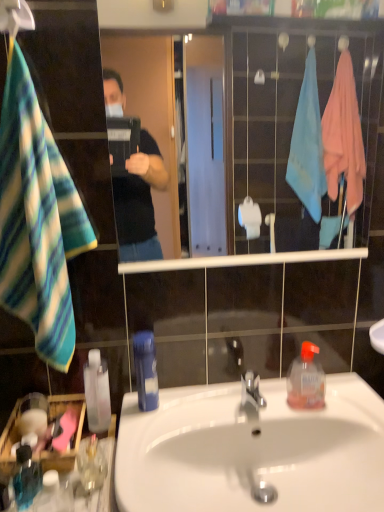
Question: Is translucent glass mug at lower left placed right next to blue plastic bottle at sink, arranged as the fourth bottle when viewed from the left?

Choices:
 (A) yes
 (B) no

Answer: (B)

Question: From the image's perspective, is translucent glass mug at lower left on blue plastic bottle at sink, the 2th bottle when ordered from right to left?

Choices:
 (A) no
 (B) yes

Answer: (A)

Question: Is translucent glass mug at lower left at the left side of blue plastic bottle at sink, the 2th bottle when ordered from right to left?

Choices:
 (A) yes
 (B) no

Answer: (A)

Question: Can you confirm if translucent glass mug at lower left is positioned to the right of blue plastic bottle at sink, arranged as the fourth bottle when viewed from the left?

Choices:
 (A) no
 (B) yes

Answer: (A)

Question: Is blue plastic bottle at sink, arranged as the fourth bottle when viewed from the left, located within translucent glass mug at lower left?

Choices:
 (A) no
 (B) yes

Answer: (A)

Question: In terms of height, does transparent plastic bottle at lower left, which is the 3th bottle from left to right, look taller or shorter compared to white glossy sink at center?

Choices:
 (A) short
 (B) tall

Answer: (A)

Question: From the image's perspective, is transparent plastic bottle at lower left, which is the 3th bottle from left to right, located above or below white glossy sink at center?

Choices:
 (A) above
 (B) below

Answer: (A)

Question: Relative to white glossy sink at center, is transparent plastic bottle at lower left, which is the 3th bottle from left to right, in front or behind?

Choices:
 (A) front
 (B) behind

Answer: (B)

Question: Is transparent plastic bottle at lower left, which is the 3th bottle from left to right, wider or thinner than white glossy sink at center?

Choices:
 (A) thin
 (B) wide

Answer: (A)

Question: From the image's perspective, is translucent glass mug at lower left positioned above or below blue plastic bottle at sink, arranged as the fourth bottle when viewed from the left?

Choices:
 (A) below
 (B) above

Answer: (A)

Question: Is translucent glass mug at lower left inside or outside of blue plastic bottle at sink, the 2th bottle when ordered from right to left?

Choices:
 (A) outside
 (B) inside

Answer: (A)

Question: Relative to blue plastic bottle at sink, arranged as the fourth bottle when viewed from the left, is translucent glass mug at lower left in front or behind?

Choices:
 (A) front
 (B) behind

Answer: (A)

Question: Is point (82, 450) closer or farther from the camera than point (152, 356)?

Choices:
 (A) closer
 (B) farther

Answer: (A)

Question: In terms of size, does translucent glass mug at lower left appear bigger or smaller than translucent plastic hand sanitizer at lower right, marked as the first bottle in a right-to-left arrangement?

Choices:
 (A) small
 (B) big

Answer: (A)

Question: From the image's perspective, is translucent glass mug at lower left positioned above or below translucent plastic hand sanitizer at lower right, marked as the first bottle in a right-to-left arrangement?

Choices:
 (A) above
 (B) below

Answer: (B)